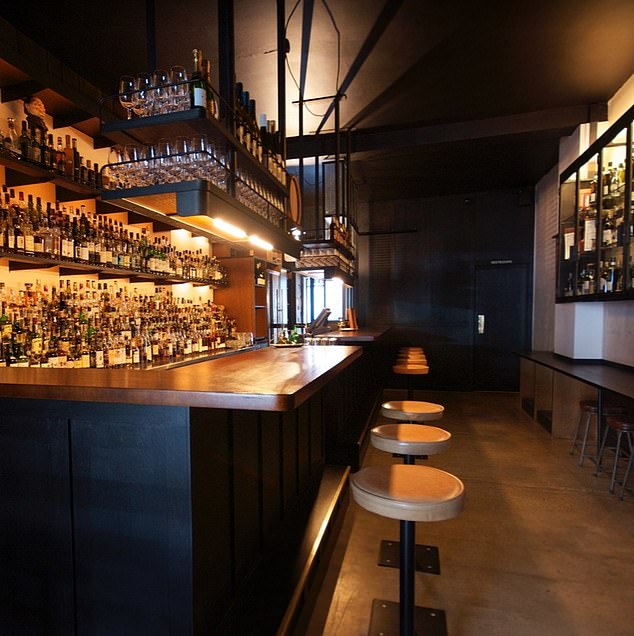
The image size is (634, 636). What are the coordinates of `rows of wine glasses` in the screenshot? It's located at (177, 165), (248, 190), (158, 97).